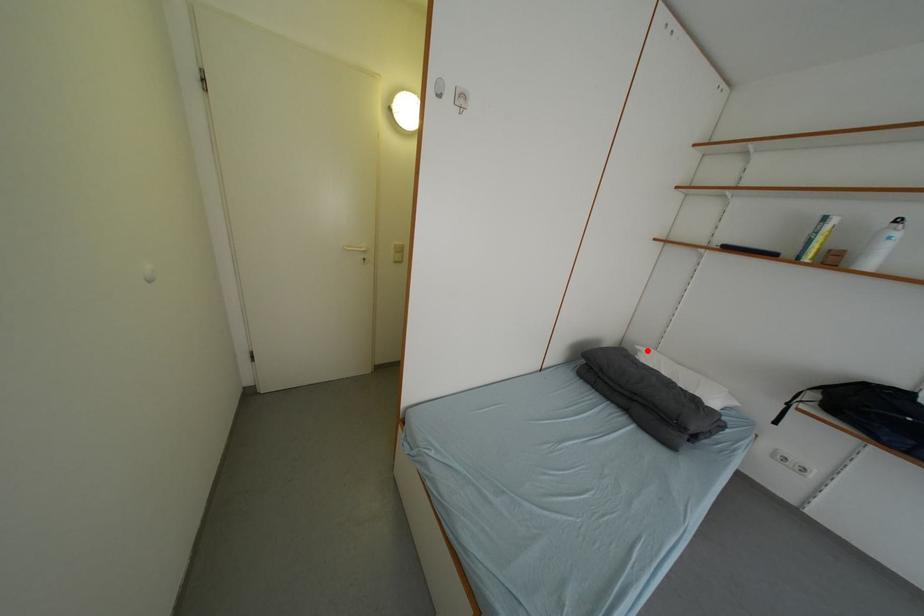
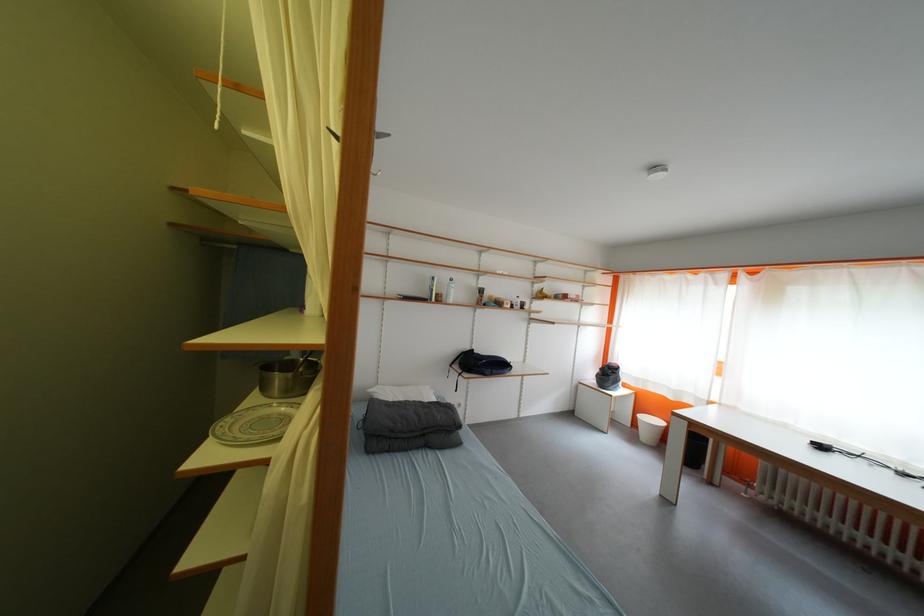
Question: I am providing you with two images of the same scene from different viewpoints. A red point is marked on the first image. Can you still see the location of the red point in image 2?

Choices:
 (A) Yes
 (B) No

Answer: (A)